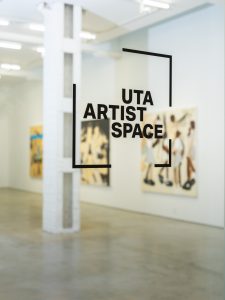
Image resolution: width=225 pixels, height=300 pixels. I want to click on gray stone flooring, so click(x=92, y=273).